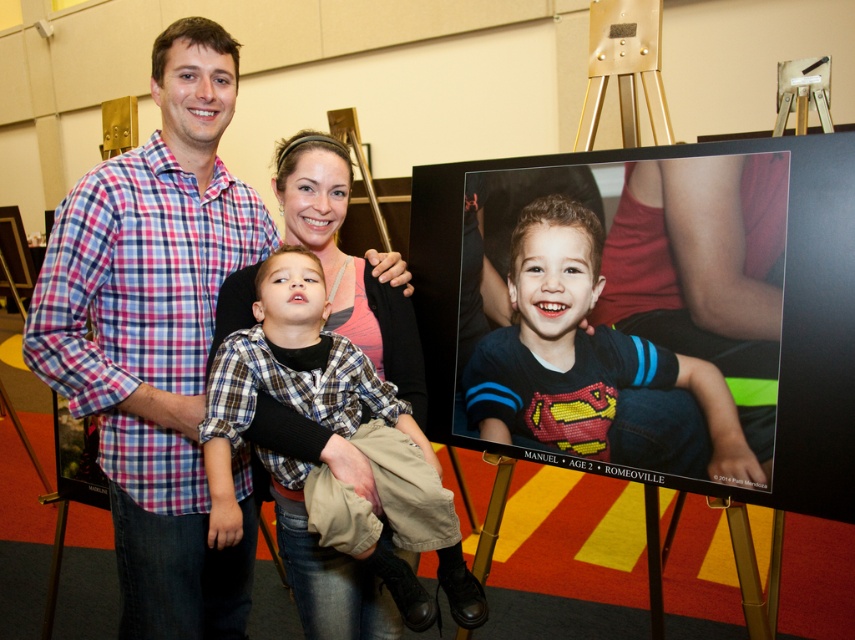
Question: Among these objects, which one is nearest to the camera?

Choices:
 (A) plaid fabric shirt at center
 (B) superman t-shirt at center
 (C) plaid cotton shirt at center

Answer: (A)

Question: Is plaid cotton shirt at center to the right of superman t-shirt at center from the viewer's perspective?

Choices:
 (A) yes
 (B) no

Answer: (B)

Question: Which object is closer to the camera taking this photo?

Choices:
 (A) superman t-shirt at center
 (B) plaid fabric shirt at center

Answer: (B)

Question: Does plaid cotton shirt at center have a greater width compared to superman t-shirt at center?

Choices:
 (A) yes
 (B) no

Answer: (B)

Question: Which point is farther to the camera?

Choices:
 (A) (599, 244)
 (B) (174, 496)
 (C) (276, 388)

Answer: (A)

Question: From the image, what is the correct spatial relationship of plaid cotton shirt at center in relation to superman t-shirt at center?

Choices:
 (A) above
 (B) below

Answer: (A)